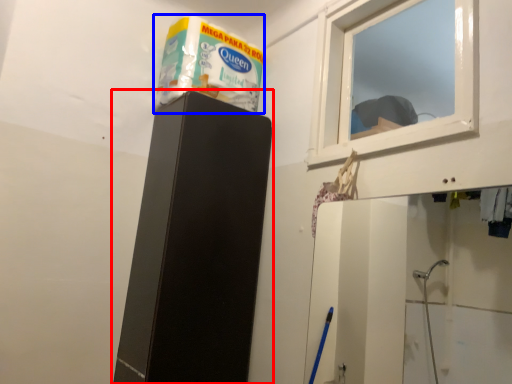
Question: Among these objects, which one is farthest to the camera, furniture (highlighted by a red box) or product (highlighted by a blue box)?

Choices:
 (A) furniture
 (B) product

Answer: (B)